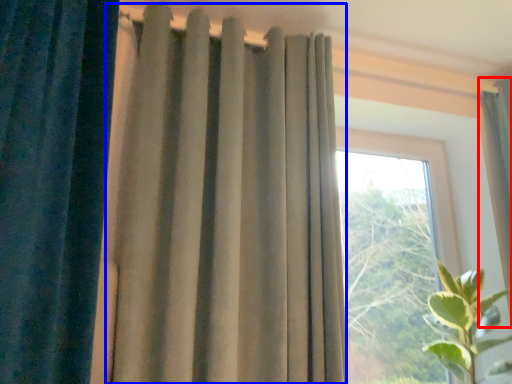
Question: Which of the following is the closest to the observer, curtain (highlighted by a red box) or curtain (highlighted by a blue box)?

Choices:
 (A) curtain
 (B) curtain

Answer: (B)